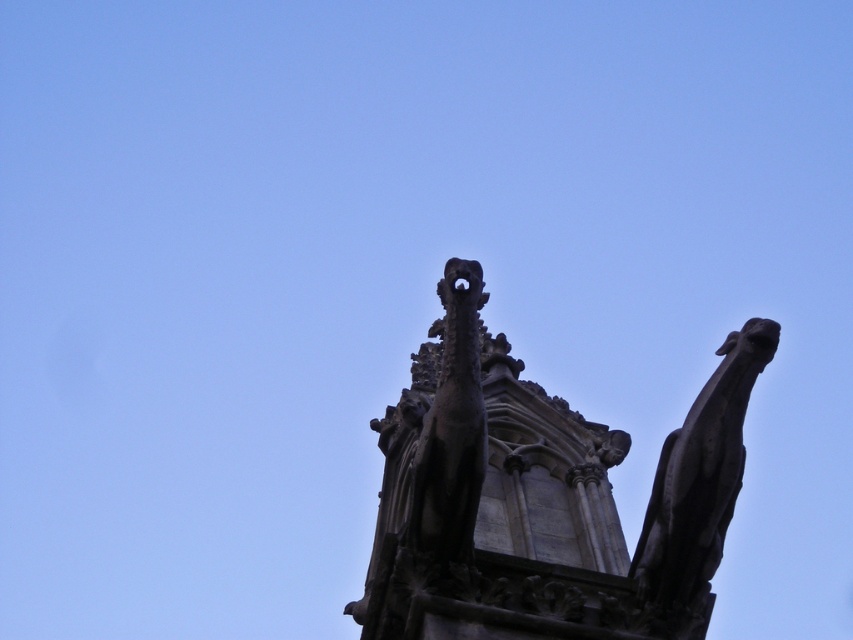
Question: Does dark gray stone gargoyle at upper center appear on the right side of dark gray stone gargoyle at upper right?

Choices:
 (A) no
 (B) yes

Answer: (A)

Question: Which point is farther from the camera taking this photo?

Choices:
 (A) (749, 374)
 (B) (384, 499)

Answer: (B)

Question: Which point is farther to the camera?

Choices:
 (A) dark gray stone gargoyle at upper center
 (B) dark gray stone gargoyle at upper right

Answer: (B)

Question: Is dark gray stone gargoyle at upper center to the right of dark gray stone gargoyle at upper right from the viewer's perspective?

Choices:
 (A) no
 (B) yes

Answer: (A)

Question: Is dark gray stone gargoyle at upper center below dark gray stone gargoyle at upper right?

Choices:
 (A) yes
 (B) no

Answer: (B)